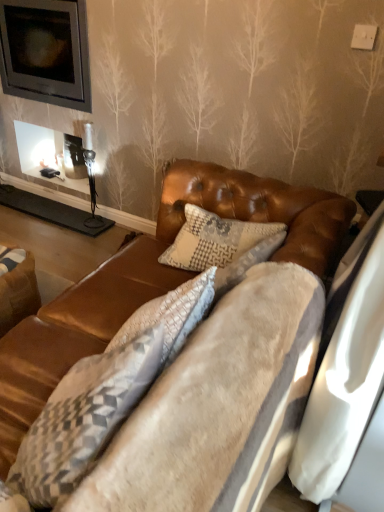
At what (x,y) coordinates should I click in order to perform the action: click on velvet brown couch at center. Please return your answer as a coordinate pair (x, y). The image size is (384, 512). Looking at the image, I should click on (159, 274).

Is textured gray pillow at center taller or shorter than brown leather swivel chair at lower left?

Clearly, textured gray pillow at center is taller compared to brown leather swivel chair at lower left.

Considering the sizes of objects textured gray pillow at center and brown leather swivel chair at lower left in the image provided, who is wider, textured gray pillow at center or brown leather swivel chair at lower left?

Wider between the two is brown leather swivel chair at lower left.

Which is closer, (106, 420) or (33, 282)?

Clearly, point (106, 420) is closer to the camera than point (33, 282).

Which of these two, textured gray pillow at center or brown leather swivel chair at lower left, is bigger?

With larger size is textured gray pillow at center.

From a real-world perspective, is velvet brown couch at center physically located above or below textured gray pillow at center?

Clearly, from a real-world perspective, velvet brown couch at center is above textured gray pillow at center.

Does velvet brown couch at center appear on the left side of textured gray pillow at center?

Incorrect, velvet brown couch at center is not on the left side of textured gray pillow at center.

What's the angular difference between velvet brown couch at center and textured gray pillow at center's facing directions?

There is a 9.95-degree angle between the facing directions of velvet brown couch at center and textured gray pillow at center.

Is point (154, 252) closer or farther from the camera than point (49, 399)?

Point (154, 252) appears to be farther away from the viewer than point (49, 399).

Measure the distance from brown leather swivel chair at lower left to velvet brown couch at center.

brown leather swivel chair at lower left and velvet brown couch at center are 23.17 inches apart.

Which point is more distant from viewer, [23,295] or [245,189]?

The point [23,295] is behind.

Is brown leather swivel chair at lower left at the left side of velvet brown couch at center?

Yes.

Is brown leather swivel chair at lower left taller than velvet brown couch at center?

Yes.

From the image's perspective, is textured gray pillow at center positioned above or below velvet brown couch at center?

textured gray pillow at center is below velvet brown couch at center.

In the scene shown: Are textured gray pillow at center and velvet brown couch at center far apart?

That's not correct — textured gray pillow at center is a little close to velvet brown couch at center.

From a real-world perspective, which object stands above the other?

velvet brown couch at center is physically above.

Between point (3, 394) and point (27, 306), which one is positioned in front?

The point (3, 394) is closer to the camera.

Does velvet brown couch at center come behind brown leather swivel chair at lower left?

That is False.

Is velvet brown couch at center not close to brown leather swivel chair at lower left?

No, velvet brown couch at center is in close proximity to brown leather swivel chair at lower left.

Does brown leather swivel chair at lower left lie behind textured gray pillow at center?

Yes, brown leather swivel chair at lower left is further from the viewer.

From a real-world perspective, is brown leather swivel chair at lower left over textured gray pillow at center?

Actually, brown leather swivel chair at lower left is physically below textured gray pillow at center in the real world.

From the image's perspective, is brown leather swivel chair at lower left located beneath textured gray pillow at center?

Incorrect, from the image's perspective, brown leather swivel chair at lower left is higher than textured gray pillow at center.

Is brown leather swivel chair at lower left outside of textured gray pillow at center?

Indeed, brown leather swivel chair at lower left is completely outside textured gray pillow at center.

There is a brown leather swivel chair at lower left. Where is `pillow above it (from a real-world perspective)`? The image size is (384, 512). pillow above it (from a real-world perspective) is located at coordinates (83, 418).

The height and width of the screenshot is (512, 384). I want to click on pillow located on the left of velvet brown couch at center, so click(83, 418).

Estimate the real-world distances between objects in this image. Which object is further from velvet brown couch at center, brown leather swivel chair at lower left or textured gray pillow at center?

Among the two, brown leather swivel chair at lower left is located further to velvet brown couch at center.

Considering their positions, is textured gray pillow at center positioned closer to velvet brown couch at center than brown leather swivel chair at lower left?

Based on the image, textured gray pillow at center appears to be nearer to velvet brown couch at center.

From the image, which object appears to be farther from textured gray pillow at center, velvet brown couch at center or brown leather swivel chair at lower left?

Based on the image, brown leather swivel chair at lower left appears to be further to textured gray pillow at center.

Considering their positions, is velvet brown couch at center positioned closer to brown leather swivel chair at lower left than textured gray pillow at center?

velvet brown couch at center is closer to brown leather swivel chair at lower left.

Based on their spatial positions, is brown leather swivel chair at lower left or velvet brown couch at center closer to textured gray pillow at center?

Based on the image, velvet brown couch at center appears to be nearer to textured gray pillow at center.

From the image, which object appears to be farther from brown leather swivel chair at lower left, textured gray pillow at center or velvet brown couch at center?

textured gray pillow at center.

Where is `pillow located between velvet brown couch at center and brown leather swivel chair at lower left in the depth direction`? Image resolution: width=384 pixels, height=512 pixels. pillow located between velvet brown couch at center and brown leather swivel chair at lower left in the depth direction is located at coordinates (83, 418).